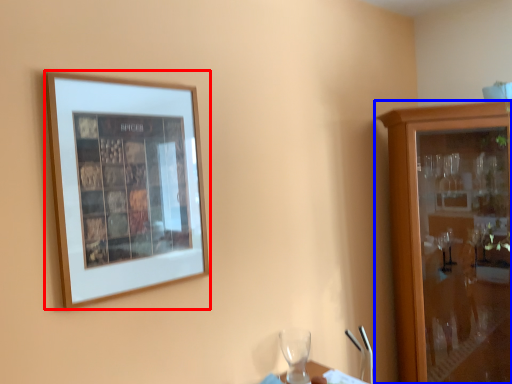
Question: Which point is closer to the camera, picture frame (highlighted by a red box) or cabinetry (highlighted by a blue box)?

Choices:
 (A) picture frame
 (B) cabinetry

Answer: (A)